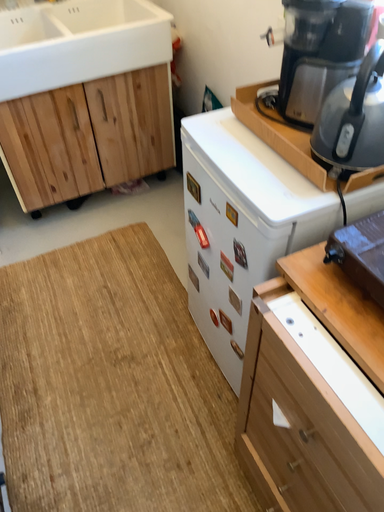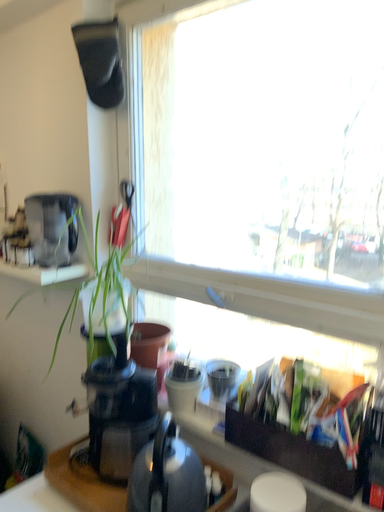
Question: How did the camera likely rotate when shooting the video?

Choices:
 (A) rotated downward
 (B) rotated upward

Answer: (B)